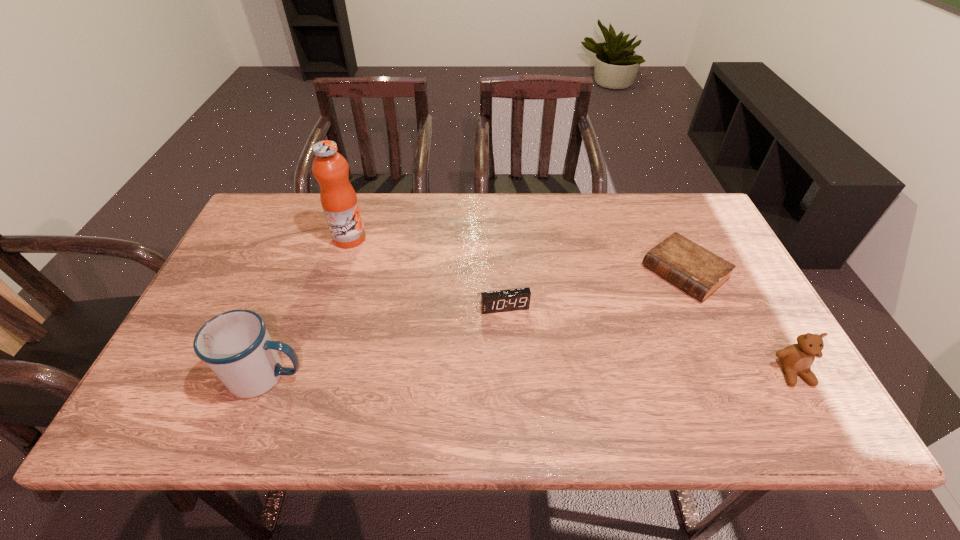
Where is `mug`? mug is located at coordinates (235, 345).

Identify the location of teddy bear. The height and width of the screenshot is (540, 960). (797, 358).

Identify the location of fruit juice. The image size is (960, 540). (339, 201).

What are the coordinates of `alarm clock` in the screenshot? It's located at (512, 299).

The height and width of the screenshot is (540, 960). I want to click on the third object from right to left, so click(x=512, y=299).

Image resolution: width=960 pixels, height=540 pixels. I want to click on the shortest object, so click(x=699, y=272).

At what (x,y) coordinates should I click in order to perform the action: click on vacant space positioned on the handle side of the mug. Please return your answer as a coordinate pair (x, y). This screenshot has height=540, width=960. Looking at the image, I should click on (388, 376).

The height and width of the screenshot is (540, 960). What are the coordinates of `vacant space located on the front label of the tallest object` in the screenshot? It's located at (398, 276).

Locate an element on the screen. free space located 0.380m on the front label of the tallest object is located at coordinates (448, 315).

Locate an element on the screen. vacant area located 0.200m on the front label of the tallest object is located at coordinates (403, 280).